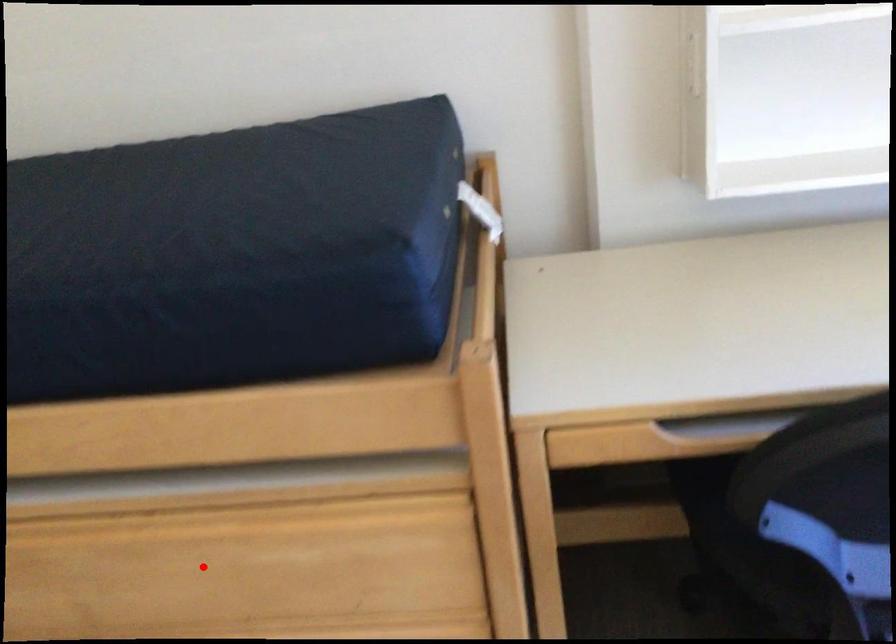
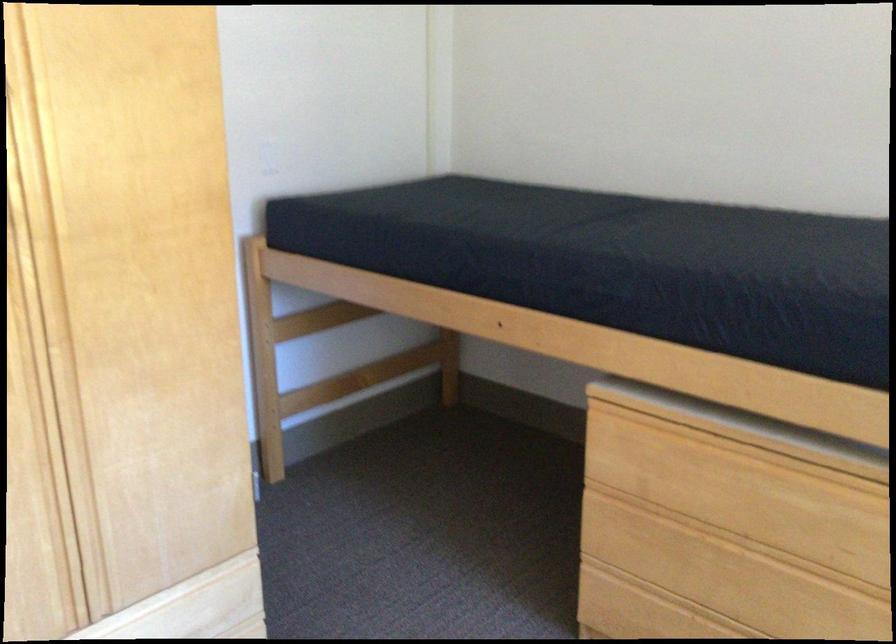
Question: I am providing you with two images of the same scene from different viewpoints. A red point is shown in image1. For the corresponding object point in image2, is it positioned nearer or farther from the camera?

Choices:
 (A) Nearer
 (B) Farther

Answer: (B)